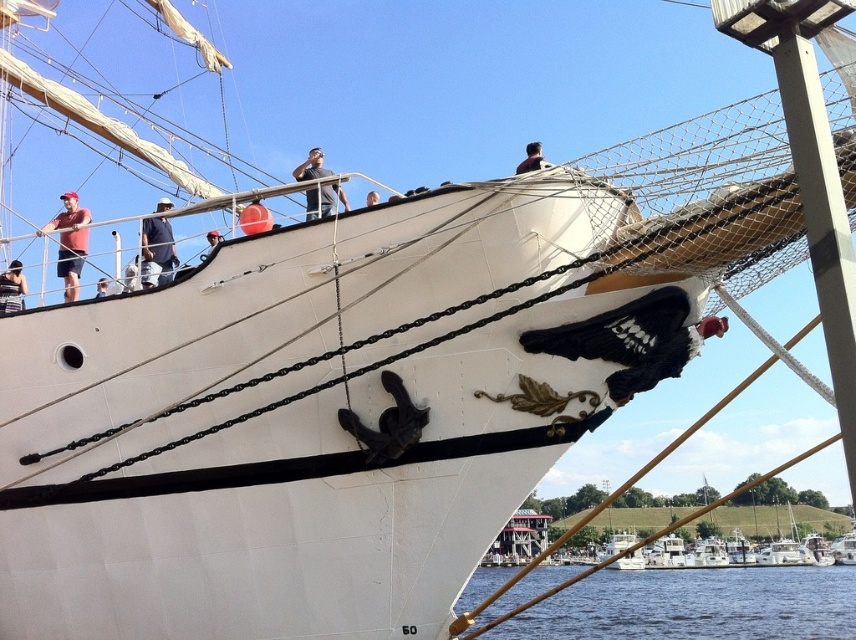
You are standing on the deck of the large white sailing ship and notice two crew members wearing a gray matte shirt at upper center and a light blue shirt at upper center. Which crew member is nearer to you?

The gray matte shirt at upper center is closer to the viewer than the light blue shirt at upper center, so the crew member in the gray matte shirt at upper center is nearer to you.

You are a crew member on the ship and need to identify the clothing items. Which object is smaller between the matte black shirt at upper left and the red helmet at upper center?

The matte black shirt at upper left is smaller than the red helmet at upper center according to the description.

You are a photographer on the deck of the ship and want to take a photo of the matte red shirt at upper left and dark blue jeans at upper left. Which object should you zoom in on to capture more details, considering their sizes?

The matte red shirt at upper left is larger in size than dark blue jeans at upper left, so you should zoom in on the matte red shirt at upper left to capture more details because it is bigger and will show more detail when magnified.